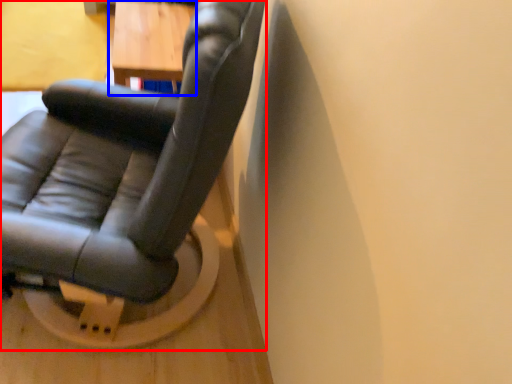
Question: Which point is closer to the camera, chair (highlighted by a red box) or table (highlighted by a blue box)?

Choices:
 (A) chair
 (B) table

Answer: (A)